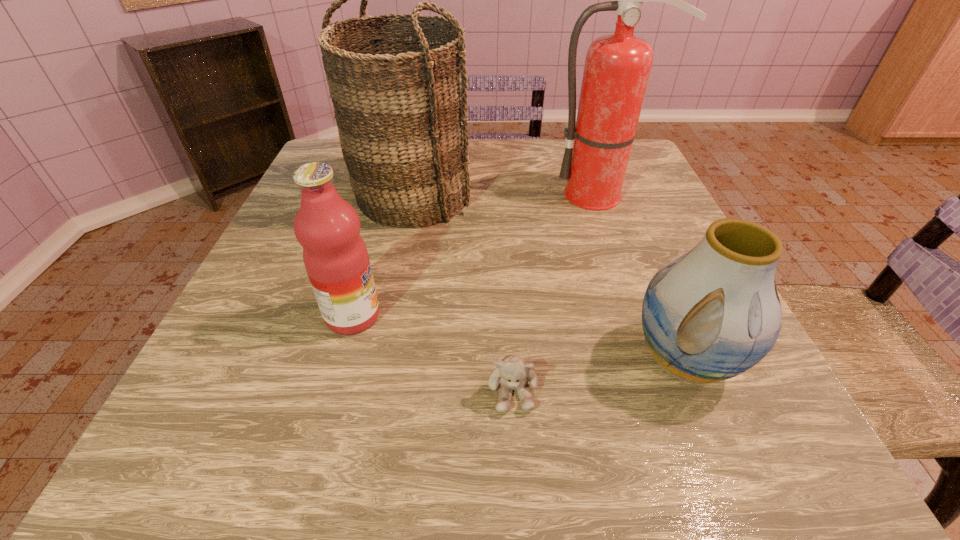
The height and width of the screenshot is (540, 960). Identify the location of free location located 0.050m on the face of the third object from left to right. (516, 451).

What are the coordinates of `fire extinguisher that is at the far edge` in the screenshot? It's located at (617, 67).

What are the coordinates of `basket that is at the far edge` in the screenshot? It's located at (400, 105).

Locate an element on the screen. object located at the near edge is located at coordinates (511, 373).

Identify the location of object located in the left edge section of the desktop. Image resolution: width=960 pixels, height=540 pixels. (400, 105).

Find the location of a particular element. The image size is (960, 540). fire extinguisher at the right edge is located at coordinates (617, 67).

Where is `vase present at the right edge`? This screenshot has height=540, width=960. vase present at the right edge is located at coordinates (714, 312).

The width and height of the screenshot is (960, 540). Identify the location of object that is positioned at the far left corner. (400, 105).

In order to click on object at the far right corner in this screenshot , I will do `click(617, 67)`.

Find the location of a particular element. vacant space at the near edge of the desktop is located at coordinates 282,452.